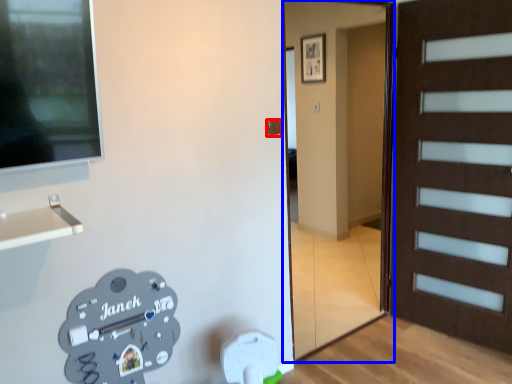
Question: Among these objects, which one is farthest to the camera, door handle (highlighted by a red box) or garage door (highlighted by a blue box)?

Choices:
 (A) door handle
 (B) garage door

Answer: (A)